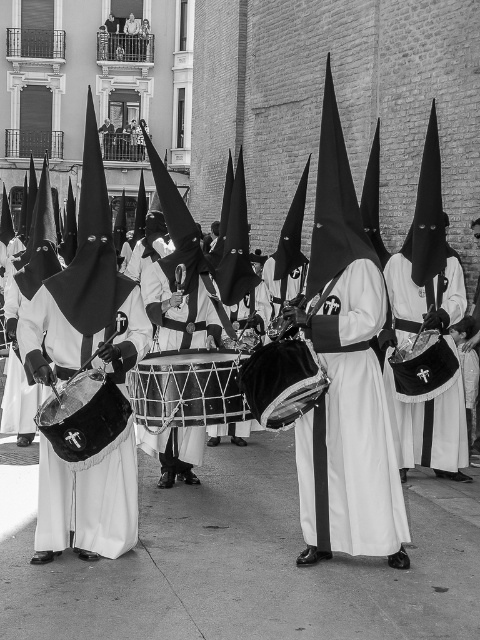
Question: Which object appears closest to the camera in this image?

Choices:
 (A) white matte fabric at center
 (B) velvet black drum at left

Answer: (B)

Question: Which point is closer to the camera taking this photo?

Choices:
 (A) (44, 442)
 (B) (168, 384)
 (C) (71, 388)
 (D) (393, 401)

Answer: (C)

Question: Which point is farther from the camera taking this photo?

Choices:
 (A) (423, 296)
 (B) (200, 410)

Answer: (A)

Question: From the image, what is the correct spatial relationship of velvet black drum at left in relation to smooth black drum at center?

Choices:
 (A) left
 (B) right

Answer: (A)

Question: From the image, what is the correct spatial relationship of velvet black drum at left in relation to smooth black drum at center?

Choices:
 (A) above
 (B) below

Answer: (B)

Question: Is velvet black drum at left positioned at the back of smooth black drum at center?

Choices:
 (A) no
 (B) yes

Answer: (A)